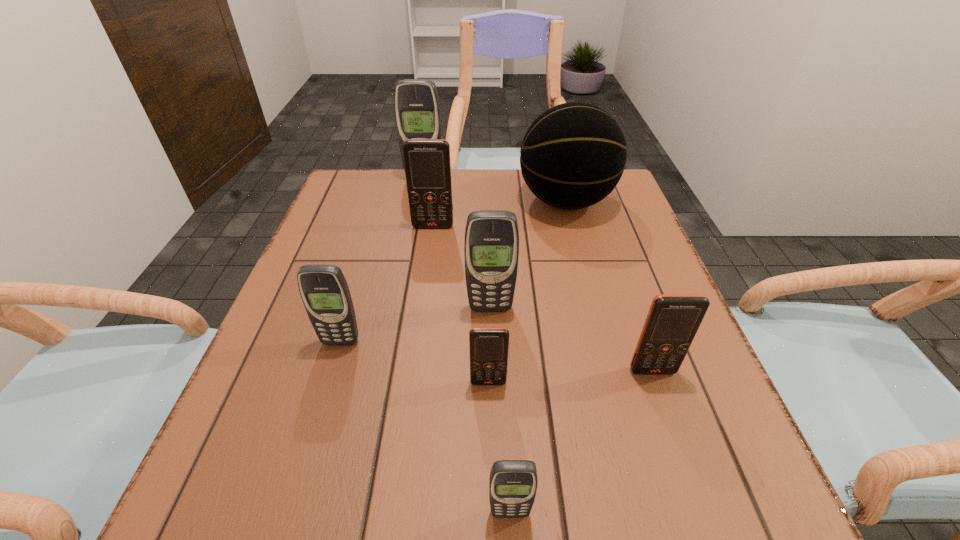
Where is `free spot between the smallest gray cellular telephone and the fifth nearest object`? This screenshot has height=540, width=960. free spot between the smallest gray cellular telephone and the fifth nearest object is located at coordinates (500, 410).

This screenshot has height=540, width=960. I want to click on unoccupied position between the nearest object and the fifth farthest cellular telephone, so click(x=581, y=442).

You are a GUI agent. You are given a task and a screenshot of the screen. Output one action in this format:
    pyautogui.click(x=<x>, y=<y>)
    Task: Click on the empty space between the nearest orange cellular telephone and the basketball
    The image size is (960, 540).
    Given the screenshot: What is the action you would take?
    pyautogui.click(x=527, y=292)

Locate an element on the screen. This screenshot has width=960, height=540. object that ranks as the closest to the basketball is located at coordinates (427, 164).

Identify which object is located as the fifth nearest to the biggest orange cellular telephone. Please provide its 2D coordinates. Your answer should be formatted as a tuple, i.e. [(x, y)], where the tuple contains the x and y coordinates of a point satisfying the conditions above.

[(489, 346)]

Identify which cellular telephone is located as the sixth nearest to the third smallest gray cellular telephone. Please provide its 2D coordinates. Your answer should be formatted as a tuple, i.e. [(x, y)], where the tuple contains the x and y coordinates of a point satisfying the conditions above.

[(417, 109)]

Locate an element on the screen. The image size is (960, 540). the sixth closest cellular telephone relative to the fourth farthest object is located at coordinates (417, 109).

Identify which gray cellular telephone is the third nearest to the farthest gray cellular telephone. Please provide its 2D coordinates. Your answer should be formatted as a tuple, i.e. [(x, y)], where the tuple contains the x and y coordinates of a point satisfying the conditions above.

[(513, 483)]

Choose which gray cellular telephone is the third nearest neighbor to the fifth nearest object. Please provide its 2D coordinates. Your answer should be formatted as a tuple, i.e. [(x, y)], where the tuple contains the x and y coordinates of a point satisfying the conditions above.

[(417, 109)]

Point out which orange cellular telephone is positioned as the nearest to the fifth nearest cellular telephone. Please provide its 2D coordinates. Your answer should be formatted as a tuple, i.e. [(x, y)], where the tuple contains the x and y coordinates of a point satisfying the conditions above.

[(489, 346)]